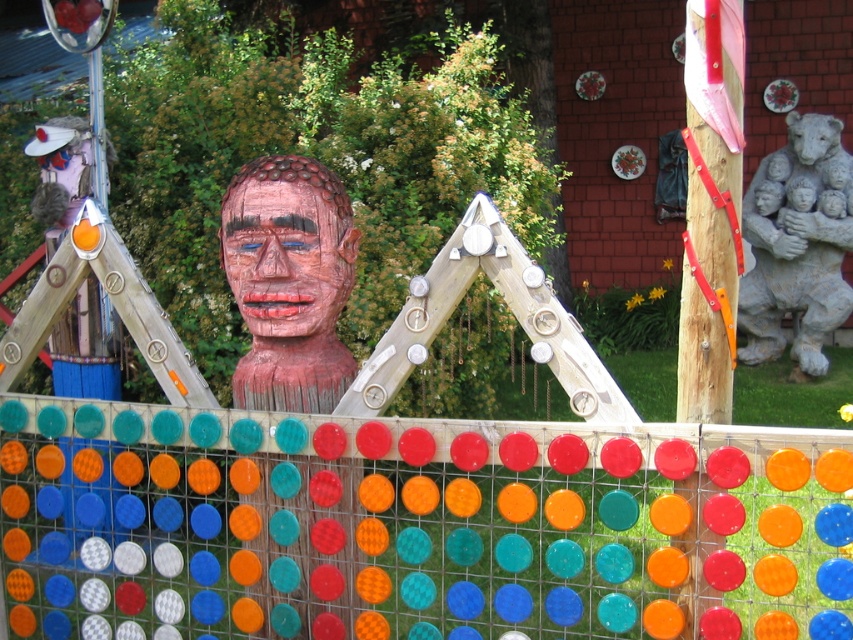
Can you confirm if gray stone bear at right is wider than wooden mask at center?

Yes.

Between gray stone bear at right and wooden mask at center, which one is positioned higher?

gray stone bear at right is higher up.

Who is more distant from viewer, [819,227] or [292,333]?

The point [819,227] is more distant.

The width and height of the screenshot is (853, 640). I want to click on gray stone bear at right, so click(798, 243).

Is wooden head at center taller than wooden mask at center?

Yes.

Is wooden head at center bigger than wooden mask at center?

Yes.

Where is `wooden head at center`? The height and width of the screenshot is (640, 853). wooden head at center is located at coordinates (289, 282).

Does wooden head at center have a greater height compared to gray stone bear at right?

In fact, wooden head at center may be shorter than gray stone bear at right.

Image resolution: width=853 pixels, height=640 pixels. What do you see at coordinates (289, 282) in the screenshot?
I see `wooden head at center` at bounding box center [289, 282].

Find the location of `wooden head at center`. wooden head at center is located at coordinates (289, 282).